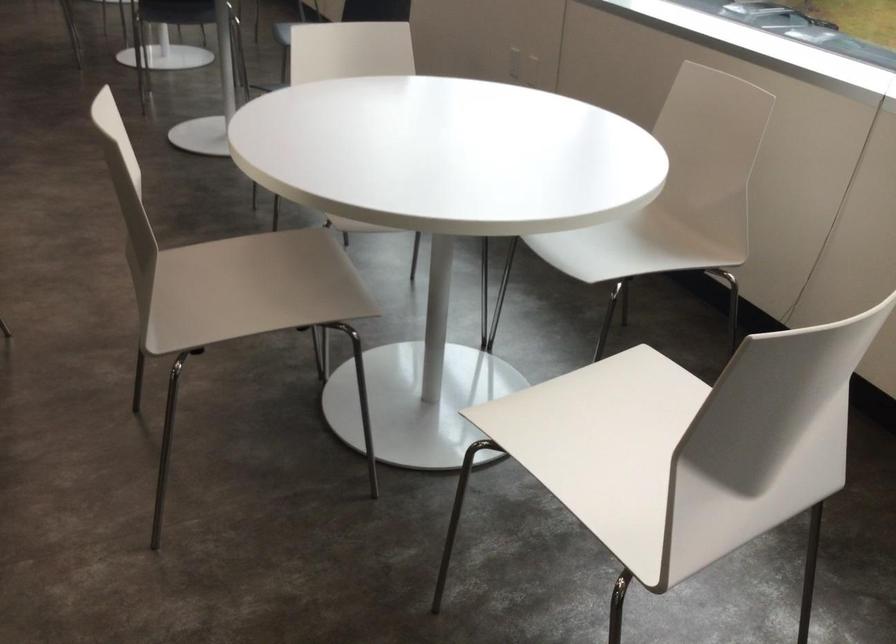
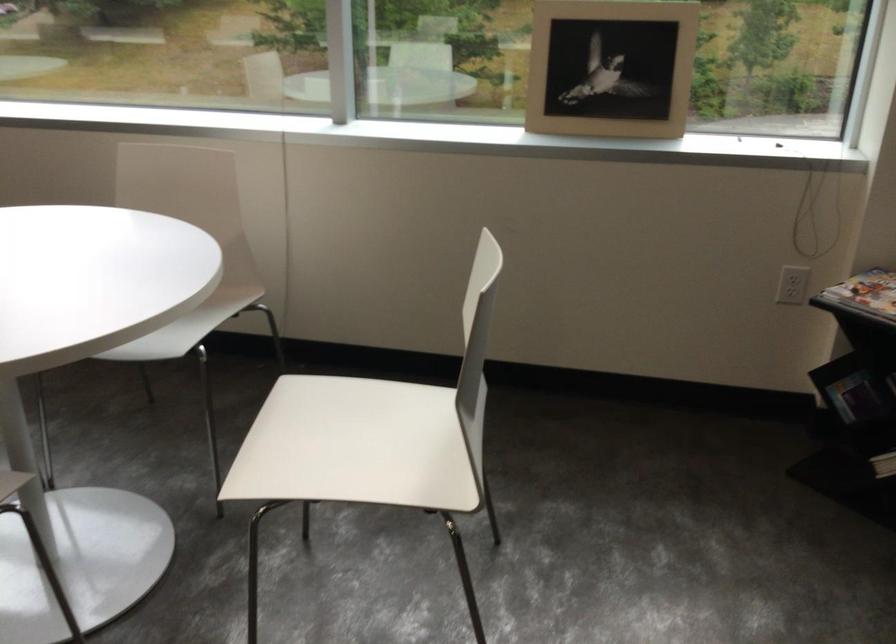
Find the pixel in the second image that matches point (607, 260) in the first image.

(186, 327)